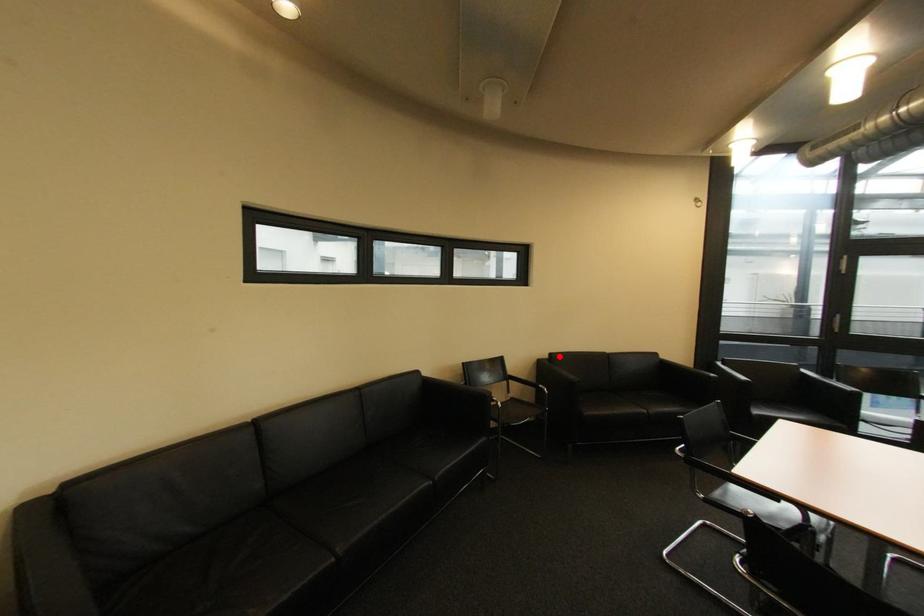
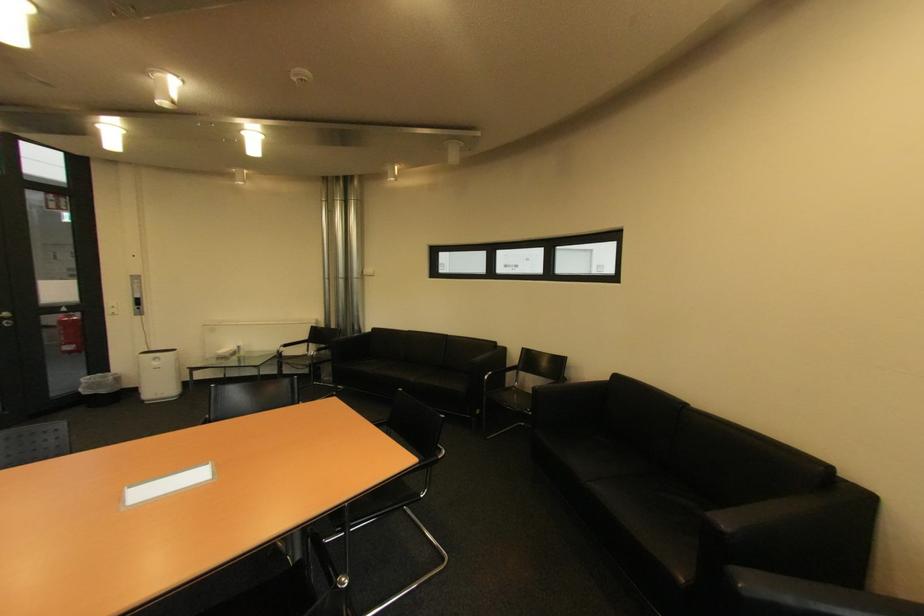
The point at the highlighted location is marked in the first image. Where is the corresponding point in the second image?

(625, 378)